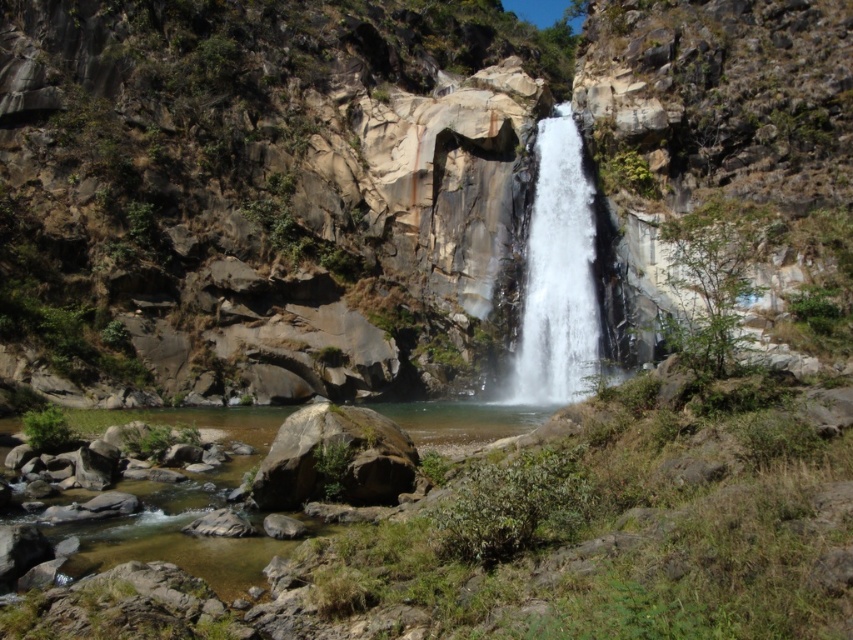
Can you confirm if white smooth waterfall at center is positioned to the left of green mossy rock at center?

Incorrect, white smooth waterfall at center is not on the left side of green mossy rock at center.

From the picture: Measure the distance between point [567,376] and camera.

A distance of 276.60 feet exists between point [567,376] and camera.

Is point (531, 401) more distant than point (347, 445)?

Yes, it is.

I want to click on white smooth waterfall at center, so click(x=558, y=275).